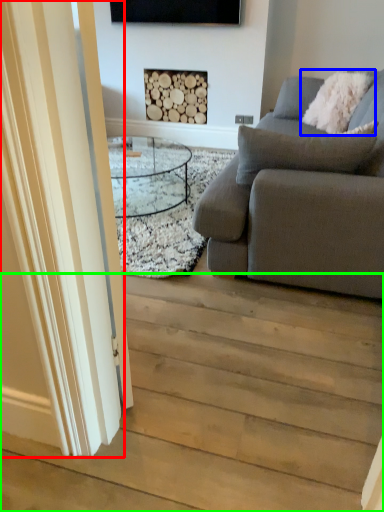
Question: Which object is the farthest from glass door (highlighted by a red box)? Choose among these: pillow (highlighted by a blue box) or stairwell (highlighted by a green box).

Choices:
 (A) pillow
 (B) stairwell

Answer: (A)